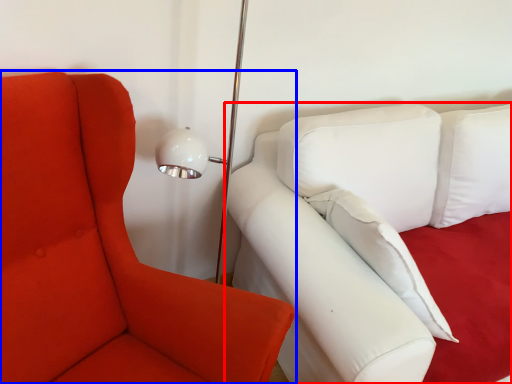
Question: Among these objects, which one is nearest to the camera, studio couch (highlighted by a red box) or chair (highlighted by a blue box)?

Choices:
 (A) studio couch
 (B) chair

Answer: (B)